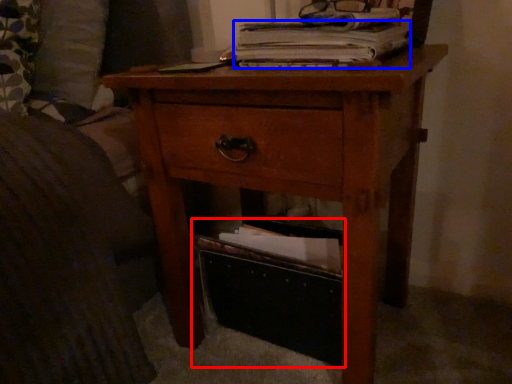
Question: Which of the following is the farthest to the observer, storage box (highlighted by a red box) or paperback book (highlighted by a blue box)?

Choices:
 (A) storage box
 (B) paperback book

Answer: (A)